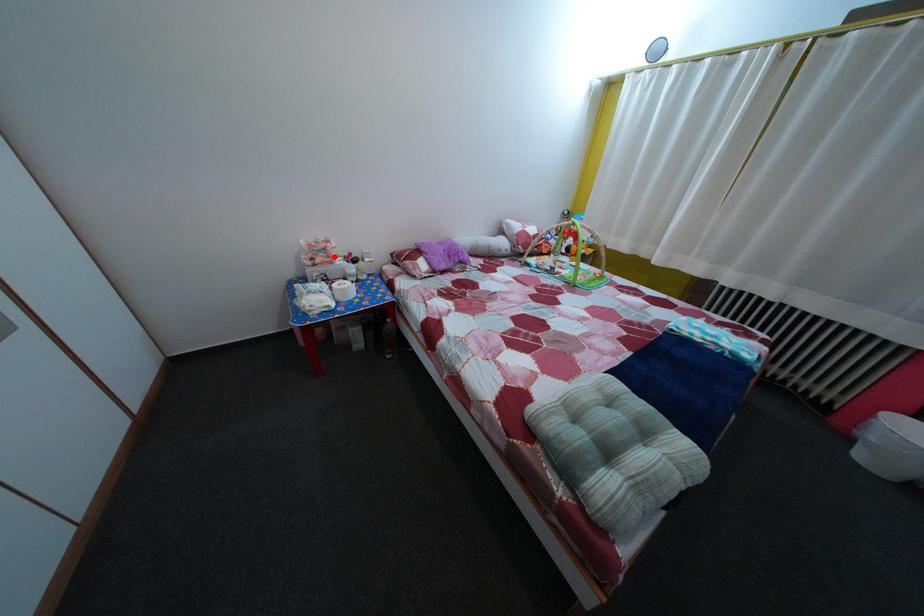
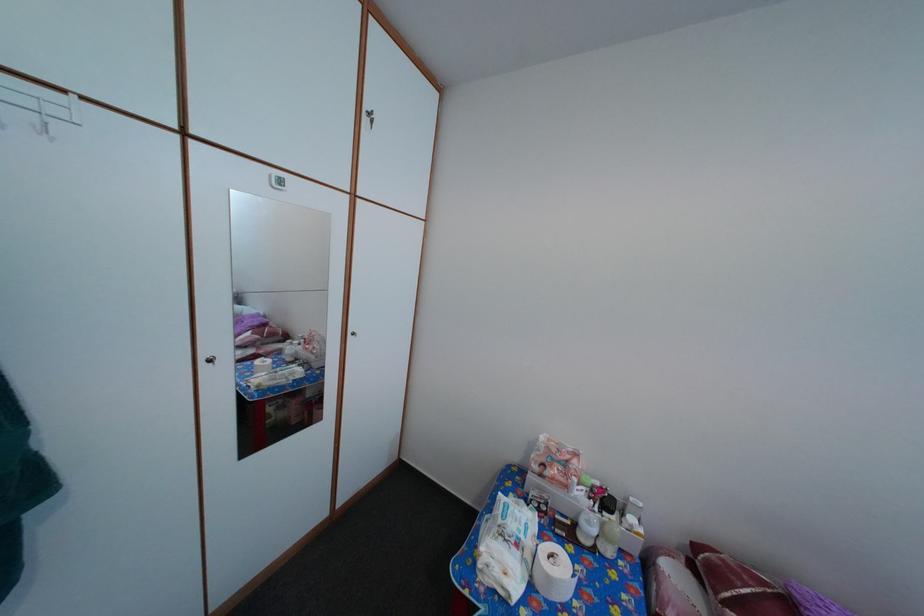
Question: I am providing you with two images of the same scene from different viewpoints. Given a red point in image1, look at the same physical point in image2. Is it:

Choices:
 (A) Closer to the viewpoint
 (B) Farther from the viewpoint

Answer: (B)